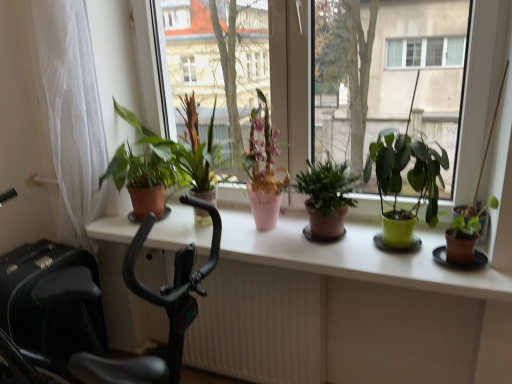
Consider the image. Measure the distance between green matte plant pot at center and camera.

green matte plant pot at center and camera are 1.55 meters apart.

Image resolution: width=512 pixels, height=384 pixels. Describe the element at coordinates (481, 88) in the screenshot. I see `green matte plant pot at center` at that location.

This screenshot has width=512, height=384. In order to click on white textured radiator at lower center in this screenshot , I will do (x=260, y=325).

Measure the distance between point (113, 158) and camera.

The depth of point (113, 158) is 1.84 meters.

The width and height of the screenshot is (512, 384). Describe the element at coordinates (407, 179) in the screenshot. I see `green matte plant at center, which is the 4th houseplant in left-to-right order` at that location.

Locate an element on the screen. This screenshot has width=512, height=384. white sheer curtain at left is located at coordinates (70, 111).

At what (x,y) coordinates should I click in order to perform the action: click on green matte plant pot at center. Please return your answer as a coordinate pair (x, y). The height and width of the screenshot is (384, 512). Looking at the image, I should click on (481, 88).

Does white textured radiator at lower center have a greater width compared to pink ceramic vase at center, which is the 4th houseplant from right to left?

In fact, white textured radiator at lower center might be narrower than pink ceramic vase at center, which is the 4th houseplant from right to left.

Based on their positions, is white textured radiator at lower center located to the left or right of pink ceramic vase at center, which is the 4th houseplant from right to left?

From the image, it's evident that white textured radiator at lower center is to the left of pink ceramic vase at center, which is the 4th houseplant from right to left.

From a real-world perspective, is white textured radiator at lower center over pink ceramic vase at center, which is the 4th houseplant from right to left?

Actually, white textured radiator at lower center is physically below pink ceramic vase at center, which is the 4th houseplant from right to left, in the real world.

Consider the image. From the image's perspective, which one is positioned lower, white textured radiator at lower center or pink ceramic vase at center, which ranks as the 2th houseplant in left-to-right order?

white textured radiator at lower center.

I want to click on baby carriage positioned vertically above the white textured radiator at lower center (from a real-world perspective), so click(156, 305).

What's the angular difference between black plastic exercise bike at left and white textured radiator at lower center's facing directions?

The angle between the facing direction of black plastic exercise bike at left and the facing direction of white textured radiator at lower center is 85.6 degrees.

Does black plastic exercise bike at left have a greater width compared to white textured radiator at lower center?

Correct, the width of black plastic exercise bike at left exceeds that of white textured radiator at lower center.

Who is more distant, black plastic exercise bike at left or white textured radiator at lower center?

white textured radiator at lower center is further away from the camera.

Is the position of green matte plant at center, the 3th houseplant viewed from the left, more distant than that of matte white windowsill at center?

Yes, green matte plant at center, the 3th houseplant viewed from the left, is behind matte white windowsill at center.

How different are the orientations of green matte plant at center, the 3th houseplant from the right, and matte white windowsill at center in degrees?

92.8 degrees separate the facing orientations of green matte plant at center, the 3th houseplant from the right, and matte white windowsill at center.

You are a GUI agent. You are given a task and a screenshot of the screen. Output one action in this format:
    pyautogui.click(x=<x>, y=<y>)
    Task: Click on the table below the green matte plant at center, the 3th houseplant viewed from the left (from a real-world perspective)
    The height and width of the screenshot is (384, 512).
    Given the screenshot: What is the action you would take?
    pyautogui.click(x=347, y=311)

Is black plastic exercise bike at left taller than green matte plant at left, arranged as the 5th houseplant when viewed from the right?

Correct, black plastic exercise bike at left is much taller as green matte plant at left, arranged as the 5th houseplant when viewed from the right.

Which is behind, point (76, 369) or point (176, 169)?

The point (176, 169) is more distant.

Could you tell me if black plastic exercise bike at left is facing green matte plant at left, the 1th houseplant when ordered from left to right?

No, black plastic exercise bike at left is not oriented towards green matte plant at left, the 1th houseplant when ordered from left to right.

Which object is positioned more to the right, black plastic exercise bike at left or green matte plant at left, arranged as the 5th houseplant when viewed from the right?

black plastic exercise bike at left.

Considering the sizes of objects white sheer curtain at left and green matte plant at left, arranged as the 5th houseplant when viewed from the right, in the image provided, who is wider, white sheer curtain at left or green matte plant at left, arranged as the 5th houseplant when viewed from the right,?

green matte plant at left, arranged as the 5th houseplant when viewed from the right, is wider.

Does point (71, 109) come behind point (147, 160)?

No.

Is white sheer curtain at left to the left or to the right of green matte plant at left, arranged as the 5th houseplant when viewed from the right, in the image?

In the image, white sheer curtain at left appears on the left side of green matte plant at left, arranged as the 5th houseplant when viewed from the right.

Is white textured radiator at lower center outside of green matte plant at center, the 3th houseplant from the right?

Yes, white textured radiator at lower center is outside of green matte plant at center, the 3th houseplant from the right.

Considering the relative sizes of white textured radiator at lower center and green matte plant at center, the 3th houseplant from the right, in the image provided, is white textured radiator at lower center shorter than green matte plant at center, the 3th houseplant from the right,?

In fact, white textured radiator at lower center may be taller than green matte plant at center, the 3th houseplant from the right.

Is white textured radiator at lower center next to green matte plant at center, the 3th houseplant from the right?

No, white textured radiator at lower center is not with green matte plant at center, the 3th houseplant from the right.

From the picture: Can you confirm if white textured radiator at lower center is bigger than green matte plant at center, the 3th houseplant viewed from the left?

Yes.

Does pink ceramic vase at center, which is the 4th houseplant from right to left, have a lesser height compared to matte white windowsill at center?

Correct, pink ceramic vase at center, which is the 4th houseplant from right to left, is not as tall as matte white windowsill at center.

Would you say pink ceramic vase at center, which is the 4th houseplant from right to left, is outside matte white windowsill at center?

Yes, pink ceramic vase at center, which is the 4th houseplant from right to left, is located beyond the bounds of matte white windowsill at center.

Can you tell me how much pink ceramic vase at center, which ranks as the 2th houseplant in left-to-right order, and matte white windowsill at center differ in facing direction?

There is a 95.2-degree angle between the facing directions of pink ceramic vase at center, which ranks as the 2th houseplant in left-to-right order, and matte white windowsill at center.

Does pink ceramic vase at center, which is the 4th houseplant from right to left, turn towards matte white windowsill at center?

Yes, pink ceramic vase at center, which is the 4th houseplant from right to left, is aimed at matte white windowsill at center.

Locate an element on the screen. Image resolution: width=512 pixels, height=384 pixels. radiator below the pink ceramic vase at center, which ranks as the 2th houseplant in left-to-right order (from the image's perspective) is located at coordinates (260, 325).

Locate an element on the screen. The image size is (512, 384). baby carriage to the left of white textured radiator at lower center is located at coordinates (156, 305).

When comparing their distances from green matte plant at center, the 3th houseplant viewed from the left, does white sheer curtain at left or green matte plant at left, the 1th houseplant when ordered from left to right, seem closer?

green matte plant at left, the 1th houseplant when ordered from left to right, lies closer to green matte plant at center, the 3th houseplant viewed from the left, than the other object.

Based on the photo, looking at the image, which one is located further to brown matte pot at right, arranged as the fifth houseplant when viewed from the left, white textured radiator at lower center or green matte plant pot at center?

Among the two, white textured radiator at lower center is located further to brown matte pot at right, arranged as the fifth houseplant when viewed from the left.

Based on their spatial positions, is green matte plant at left, arranged as the 5th houseplant when viewed from the right, or green matte plant pot at center closer to white sheer curtain at left?

green matte plant at left, arranged as the 5th houseplant when viewed from the right, is closer to white sheer curtain at left.

Based on their spatial positions, is white sheer curtain at left or black plastic exercise bike at left further from green matte plant at center, which is the 4th houseplant in left-to-right order?

Among the two, white sheer curtain at left is located further to green matte plant at center, which is the 4th houseplant in left-to-right order.

Estimate the real-world distances between objects in this image. Which object is closer to matte white windowsill at center, green matte plant at left, arranged as the 5th houseplant when viewed from the right, or white sheer curtain at left?

green matte plant at left, arranged as the 5th houseplant when viewed from the right, lies closer to matte white windowsill at center than the other object.

Considering their positions, is white textured radiator at lower center positioned closer to green matte plant at center, the 3th houseplant viewed from the left, than green matte plant at center, which is the 4th houseplant in left-to-right order?

green matte plant at center, which is the 4th houseplant in left-to-right order, lies closer to green matte plant at center, the 3th houseplant viewed from the left, than the other object.

Considering their positions, is white sheer curtain at left positioned further to black plastic exercise bike at left than green matte plant pot at center?

green matte plant pot at center is positioned further to the anchor black plastic exercise bike at left.

Based on their spatial positions, is white textured radiator at lower center or black plastic exercise bike at left closer to matte white windowsill at center?

white textured radiator at lower center lies closer to matte white windowsill at center than the other object.

You are a GUI agent. You are given a task and a screenshot of the screen. Output one action in this format:
    pyautogui.click(x=<x>, y=<y>)
    Task: Click on the houseplant between green matte plant at left, arranged as the 5th houseplant when viewed from the right, and green matte plant at center, the 3th houseplant from the right, from left to right
    
    Given the screenshot: What is the action you would take?
    pyautogui.click(x=263, y=167)

Image resolution: width=512 pixels, height=384 pixels. Find the location of `baby carriage between matte white windowsill at center and brown matte pot at right, which is counted as the first houseplant, starting from the right, from left to right`. baby carriage between matte white windowsill at center and brown matte pot at right, which is counted as the first houseplant, starting from the right, from left to right is located at coordinates (156, 305).

Locate an element on the screen. The width and height of the screenshot is (512, 384). radiator between green matte plant at left, arranged as the 5th houseplant when viewed from the right, and green matte plant at center, the 3th houseplant from the right, from left to right is located at coordinates (260, 325).

Where is `baby carriage between white sheer curtain at left and pink ceramic vase at center, which is the 4th houseplant from right to left, in the horizontal direction`? baby carriage between white sheer curtain at left and pink ceramic vase at center, which is the 4th houseplant from right to left, in the horizontal direction is located at coordinates (156, 305).